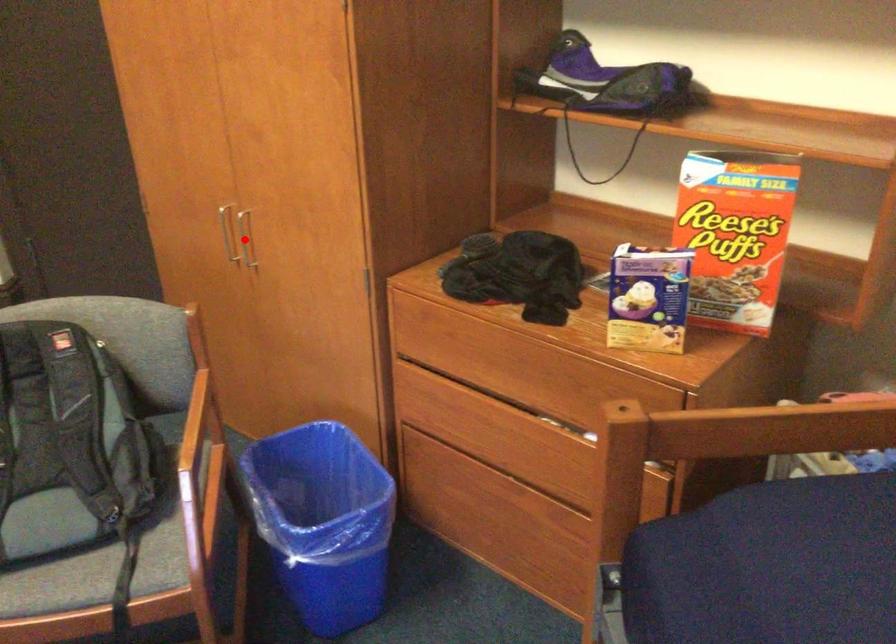
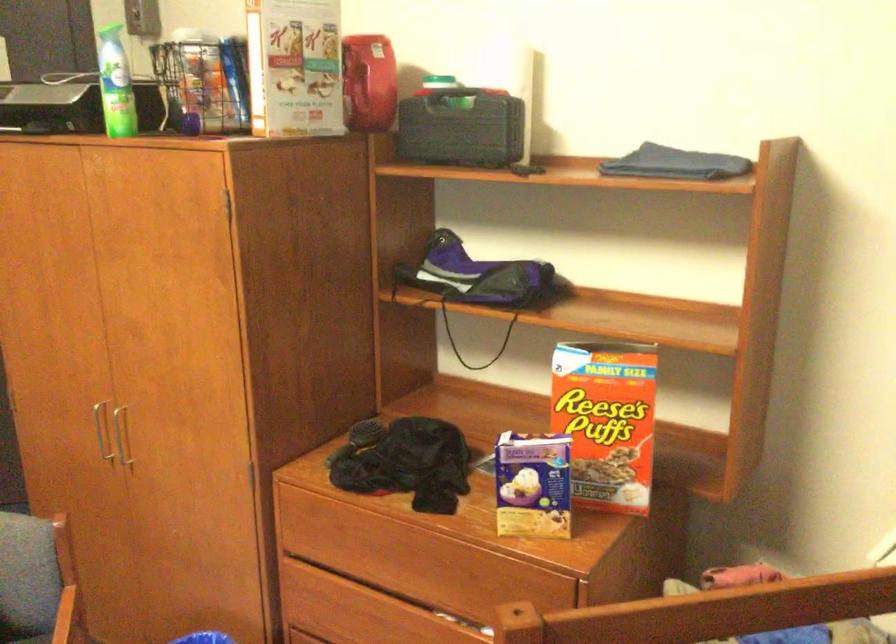
Find the pixel in the second image that matches the highlighted location in the first image.

(119, 436)